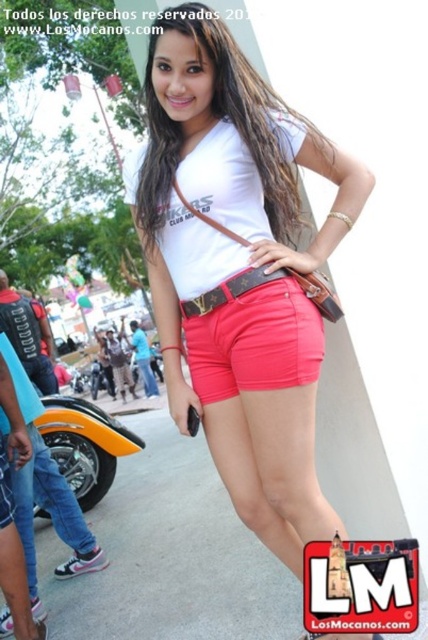
You are standing at point [285,269] and want to move to point [163,186]. Which direction should you move in?

You should move forward because point [163,186] is behind point [285,269], meaning it is in the direction you are facing.

You are a photographer at the event and need to capture a photo that includes both the orange matte motorcycle at lower left and the brown leather belt at center. Which object should you adjust your camera angle to focus on first if you want to ensure both are fully visible in the frame?

The orange matte motorcycle at lower left is wider than the brown leather belt at center, so you should focus on framing the motorcycle first to ensure the belt fits within the shot.